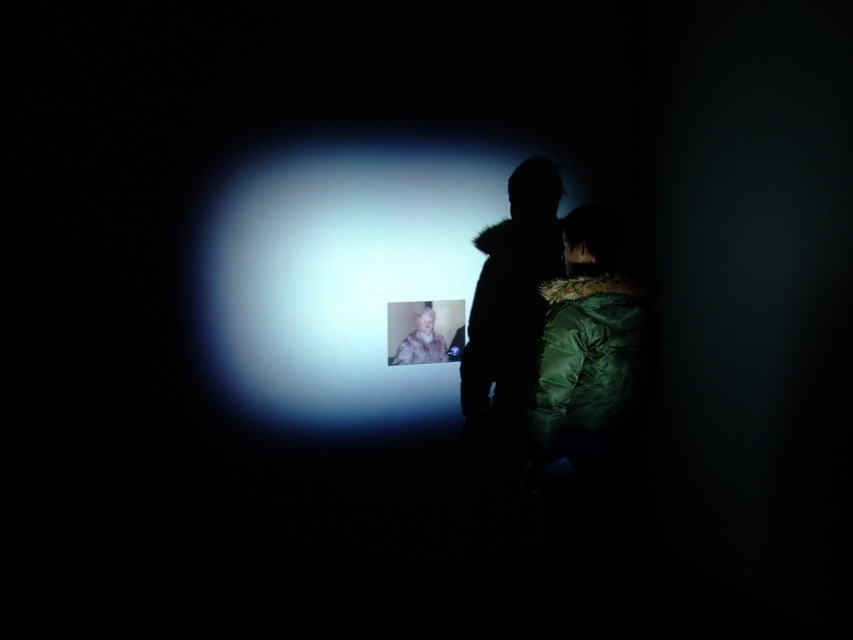
You are a person trying to put on a coat in the dimly lit space. You see the dark fur coat at center and the green down jacket at center. Which one can you put on first without moving the other?

The dark fur coat at center is positioned over the green down jacket at center, so you can put on the dark fur coat at center first without moving the green down jacket at center.

You are standing in the room and notice two coats hanging on a rack between the projection screen and the entrance. The coats are described as dark fur coat at center and white fur coat at center. Which coat is closer to the projection screen?

The dark fur coat at center is to the right of the white fur coat at center. Since the projection screen is on one side and the entrance on the other, the dark fur coat at center being on the right side would be closer to the projection screen if the entrance is on the left, but without knowing the exact positioning of the entrance relative to the screen, we cannot definitively determine which coat is closer to the screen based solely on their left or right orientation.